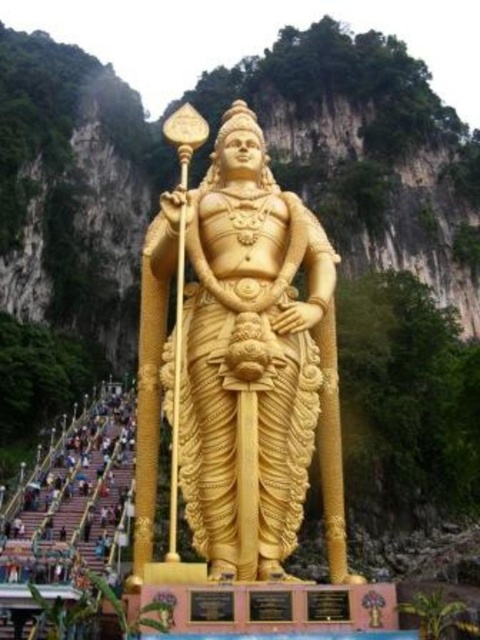
Question: Is gold polished statue at center to the right of metallic staircase at lower left from the viewer's perspective?

Choices:
 (A) yes
 (B) no

Answer: (A)

Question: Which point is farther from the camera taking this photo?

Choices:
 (A) (72, 433)
 (B) (236, 179)

Answer: (A)

Question: Which point appears closest to the camera in this image?

Choices:
 (A) (199, 227)
 (B) (112, 547)

Answer: (A)

Question: Is gold polished statue at center wider than metallic staircase at lower left?

Choices:
 (A) no
 (B) yes

Answer: (A)

Question: Is gold polished statue at center positioned in front of metallic staircase at lower left?

Choices:
 (A) no
 (B) yes

Answer: (B)